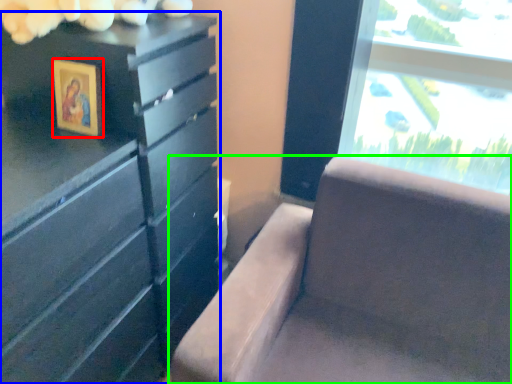
Question: Based on their relative distances, which object is nearer to picture frame (highlighted by a red box)? Choose from chest of drawers (highlighted by a blue box) and furniture (highlighted by a green box).

Choices:
 (A) chest of drawers
 (B) furniture

Answer: (A)